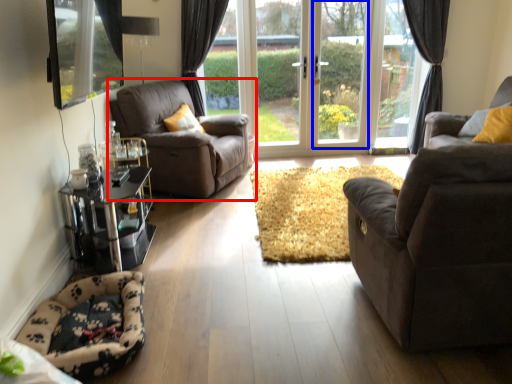
Question: Which object is further to the camera taking this photo, chair (highlighted by a red box) or window frame (highlighted by a blue box)?

Choices:
 (A) chair
 (B) window frame

Answer: (B)